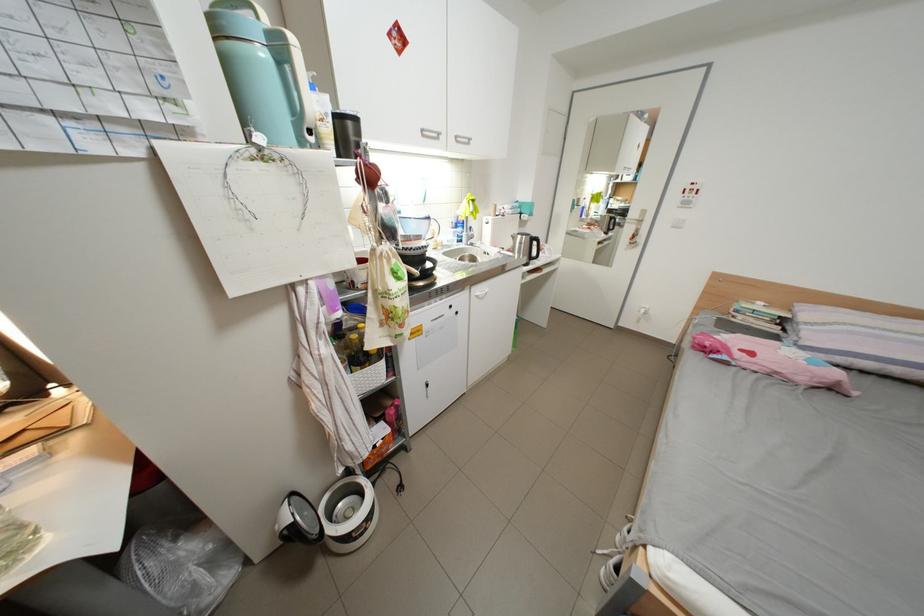
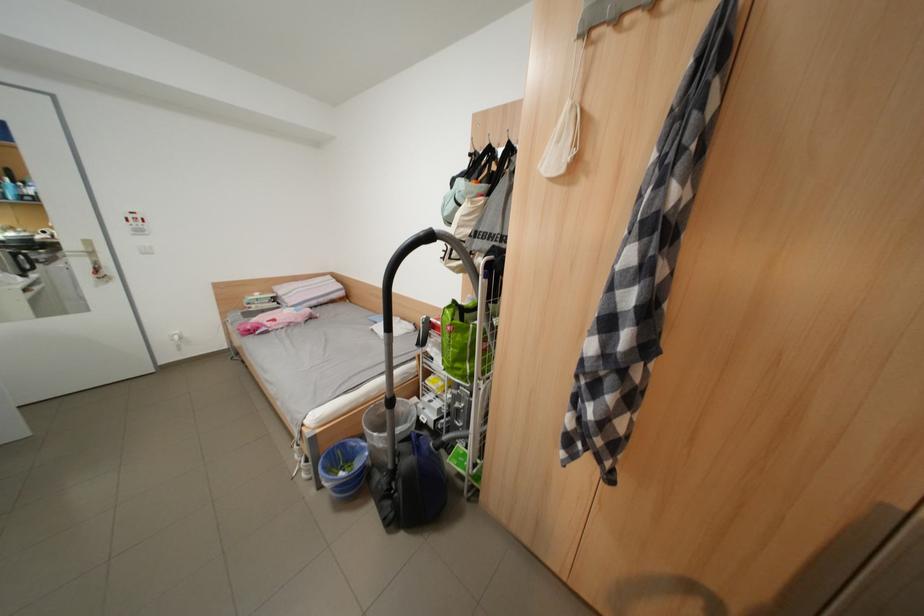
In the second image, find the point that corresponds to point (698, 205) in the first image.

(152, 233)